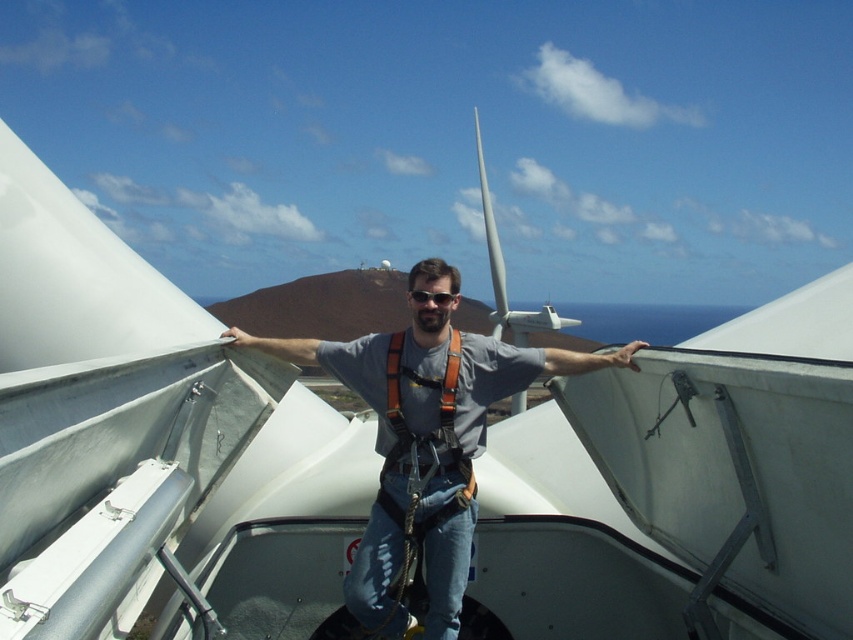
Describe the element at coordinates (428, 387) in the screenshot. I see `orange fabric safety vest at center` at that location.

Is orange fabric safety vest at center positioned in front of black plastic goggles at center?

Yes, orange fabric safety vest at center is in front of black plastic goggles at center.

You are a GUI agent. You are given a task and a screenshot of the screen. Output one action in this format:
    pyautogui.click(x=<x>, y=<y>)
    Task: Click on the orange fabric safety vest at center
    Image resolution: width=853 pixels, height=640 pixels.
    Given the screenshot: What is the action you would take?
    pyautogui.click(x=428, y=387)

Between point (459, 586) and point (439, 307), which one is positioned in front?

Point (459, 586) is in front.

Does point (450, 540) lie behind point (442, 292)?

No, it is in front of (442, 292).

Where is `gray fabric construction worker at center`? The width and height of the screenshot is (853, 640). gray fabric construction worker at center is located at coordinates (425, 442).

Is gray fabric construction worker at center in front of orange fabric safety vest at center?

No, gray fabric construction worker at center is behind orange fabric safety vest at center.

Measure the distance between gray fabric construction worker at center and orange fabric safety vest at center.

3.90 feet

Measure the distance between gray fabric construction worker at center and camera.

gray fabric construction worker at center and camera are 7.24 meters apart.

Locate an element on the screen. The height and width of the screenshot is (640, 853). gray fabric construction worker at center is located at coordinates (425, 442).